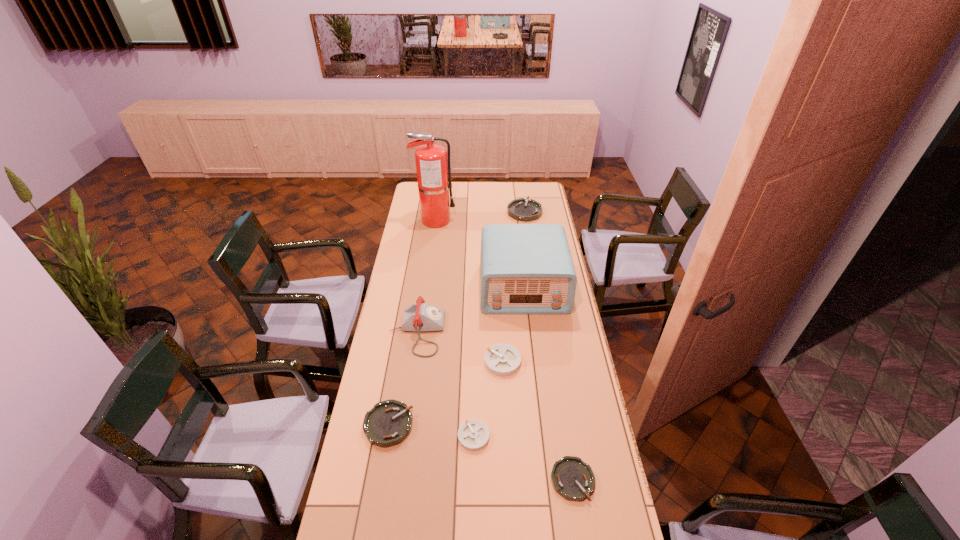
At what (x,y) coordinates should I click in order to perform the action: click on the second farthest green ashtray. Please return your answer as a coordinate pair (x, y). The width and height of the screenshot is (960, 540). Looking at the image, I should click on (388, 423).

Locate an element on the screen. the nearer gray ashtray is located at coordinates (473, 435).

Image resolution: width=960 pixels, height=540 pixels. Find the location of `the smallest green ashtray`. the smallest green ashtray is located at coordinates (573, 479).

The image size is (960, 540). Find the location of `the nearest object`. the nearest object is located at coordinates (573, 479).

This screenshot has height=540, width=960. What are the coordinates of `free space located at the nozzle of the red fire extinguisher` in the screenshot? It's located at (473, 220).

Where is `free region located on the front panel of the seventh shortest object`? The image size is (960, 540). free region located on the front panel of the seventh shortest object is located at coordinates (533, 375).

Where is `vacant space located on the dial of the telephone`? The height and width of the screenshot is (540, 960). vacant space located on the dial of the telephone is located at coordinates point(482,332).

This screenshot has width=960, height=540. I want to click on vacant area located 0.100m on the left of the biggest green ashtray, so click(x=490, y=212).

Find the location of a particular element. blank space located 0.120m on the left of the bigger gray ashtray is located at coordinates (454, 362).

I want to click on vacant region located 0.130m on the back of the second farthest green ashtray, so click(x=397, y=374).